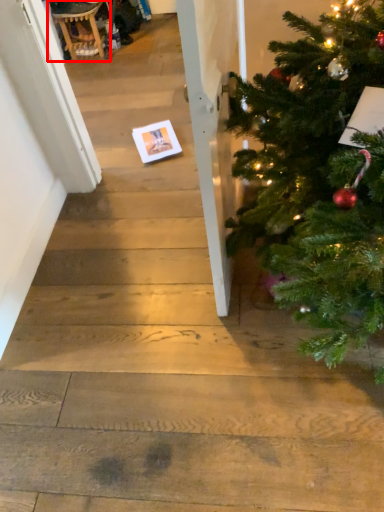
Question: From the image's perspective, where is rocking chair (annotated by the red box) located in relation to christmas card in the image?

Choices:
 (A) below
 (B) above

Answer: (B)